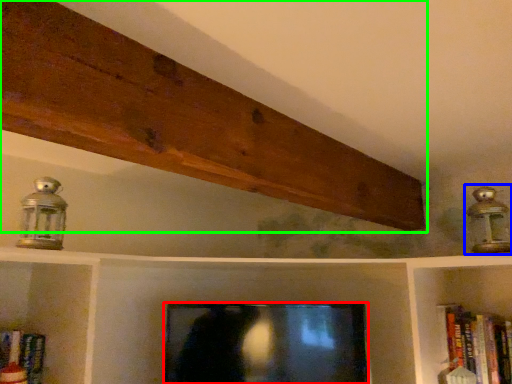
Question: Estimate the real-world distances between objects in this image. Which object is farther from television (highlighted by a red box), lamp (highlighted by a blue box) or plank (highlighted by a green box)?

Choices:
 (A) lamp
 (B) plank

Answer: (A)